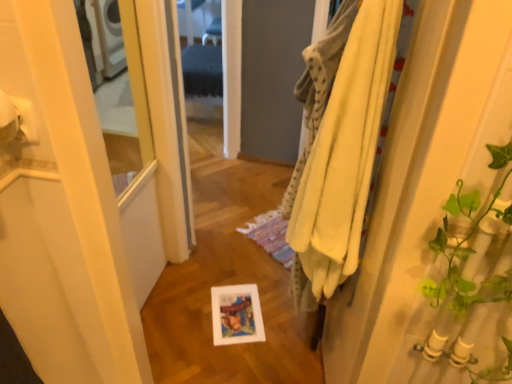
Question: Can you confirm if yellow fabric at right is smaller than yellow cotton bath towel at right, the 2th bath towel when ordered from bottom to top?

Choices:
 (A) no
 (B) yes

Answer: (A)

Question: Can you confirm if yellow fabric at right is thinner than yellow cotton bath towel at right, the 1th bath towel when ordered from top to bottom?

Choices:
 (A) no
 (B) yes

Answer: (B)

Question: From the image's perspective, does yellow fabric at right appear higher than yellow cotton bath towel at right, the 2th bath towel when ordered from bottom to top?

Choices:
 (A) no
 (B) yes

Answer: (A)

Question: From a real-world perspective, is yellow fabric at right physically below yellow cotton bath towel at right, the 1th bath towel when ordered from top to bottom?

Choices:
 (A) no
 (B) yes

Answer: (B)

Question: Is yellow fabric at right not within yellow cotton bath towel at right, the 1th bath towel when ordered from top to bottom?

Choices:
 (A) no
 (B) yes

Answer: (B)

Question: Would you say yellow fabric at right is inside or outside yellow soft towel at right, the 1th bath towel ordered from the bottom?

Choices:
 (A) outside
 (B) inside

Answer: (A)

Question: Considering their positions, is yellow fabric at right located in front of or behind yellow soft towel at right, acting as the second bath towel starting from the top?

Choices:
 (A) behind
 (B) front

Answer: (B)

Question: In the image, is yellow fabric at right on the left side or the right side of yellow soft towel at right, the 1th bath towel ordered from the bottom?

Choices:
 (A) right
 (B) left

Answer: (A)

Question: From the image's perspective, is yellow fabric at right positioned above or below yellow soft towel at right, acting as the second bath towel starting from the top?

Choices:
 (A) above
 (B) below

Answer: (B)

Question: Based on their sizes in the image, would you say white matte toilet paper at upper left is bigger or smaller than yellow cotton bath towel at right, the 2th bath towel when ordered from bottom to top?

Choices:
 (A) small
 (B) big

Answer: (A)

Question: In terms of height, does white matte toilet paper at upper left look taller or shorter compared to yellow cotton bath towel at right, the 2th bath towel when ordered from bottom to top?

Choices:
 (A) short
 (B) tall

Answer: (A)

Question: Is white matte toilet paper at upper left inside or outside of yellow cotton bath towel at right, the 2th bath towel when ordered from bottom to top?

Choices:
 (A) inside
 (B) outside

Answer: (B)

Question: From the image's perspective, is white matte toilet paper at upper left located above or below yellow cotton bath towel at right, the 1th bath towel when ordered from top to bottom?

Choices:
 (A) above
 (B) below

Answer: (B)

Question: Visually, is white matte toilet paper at upper left positioned to the left or to the right of yellow soft towel at right, acting as the second bath towel starting from the top?

Choices:
 (A) left
 (B) right

Answer: (A)

Question: In terms of width, does white matte toilet paper at upper left look wider or thinner when compared to yellow soft towel at right, acting as the second bath towel starting from the top?

Choices:
 (A) thin
 (B) wide

Answer: (A)